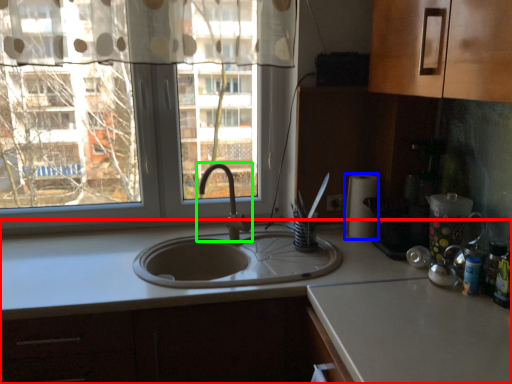
Question: Based on their relative distances, which object is farther from countertop (highlighted by a red box)? Choose from paper towel (highlighted by a blue box) and tap (highlighted by a green box).

Choices:
 (A) paper towel
 (B) tap

Answer: (B)